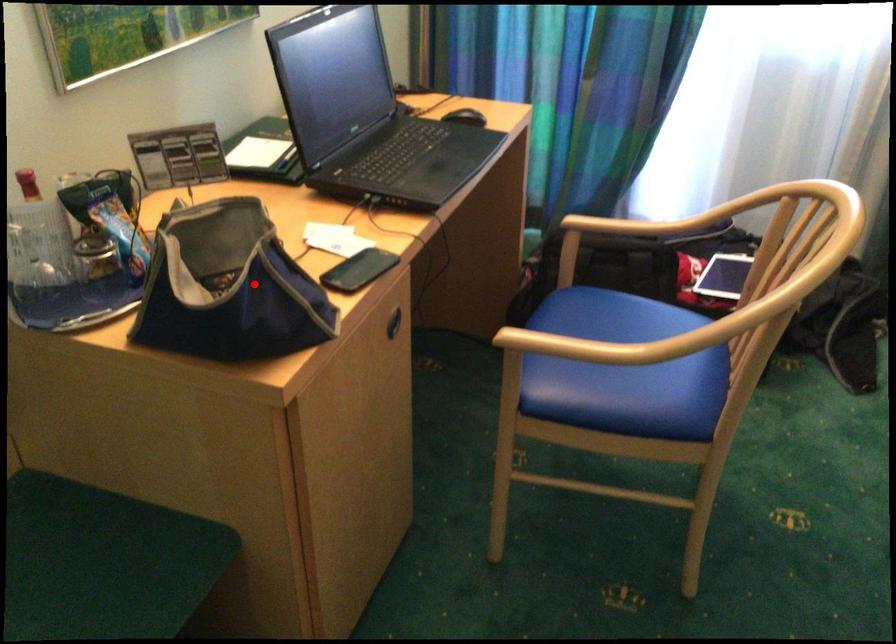
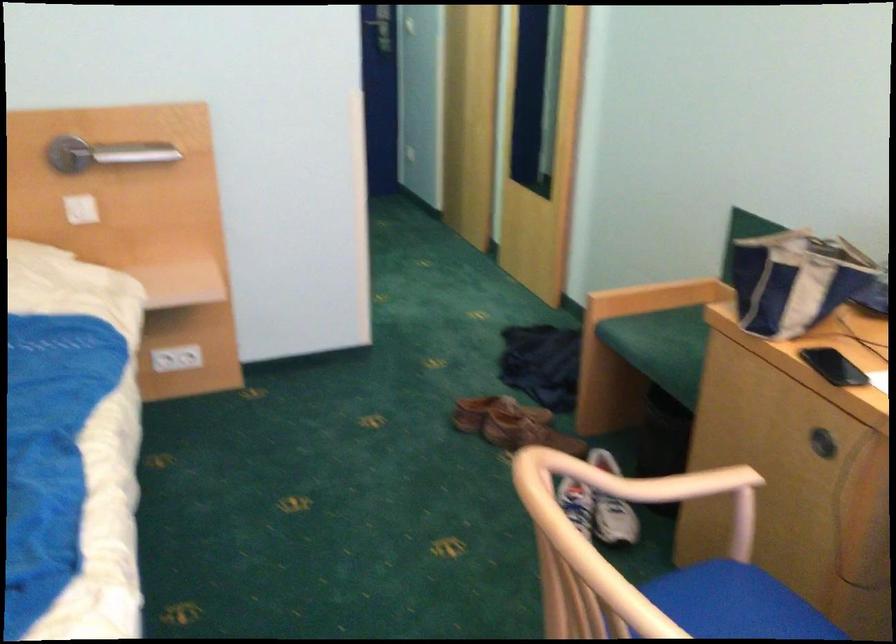
Locate, in the second image, the point that corresponds to the highlighted location in the first image.

(794, 279)